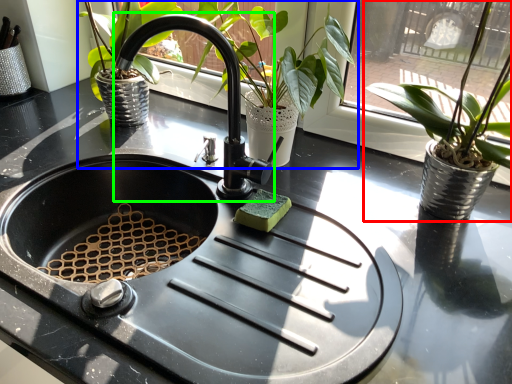
Question: Which object is the closest to the houseplant (highlighted by a red box)? Choose among these: houseplant (highlighted by a blue box) or faucet (highlighted by a green box).

Choices:
 (A) houseplant
 (B) faucet

Answer: (A)